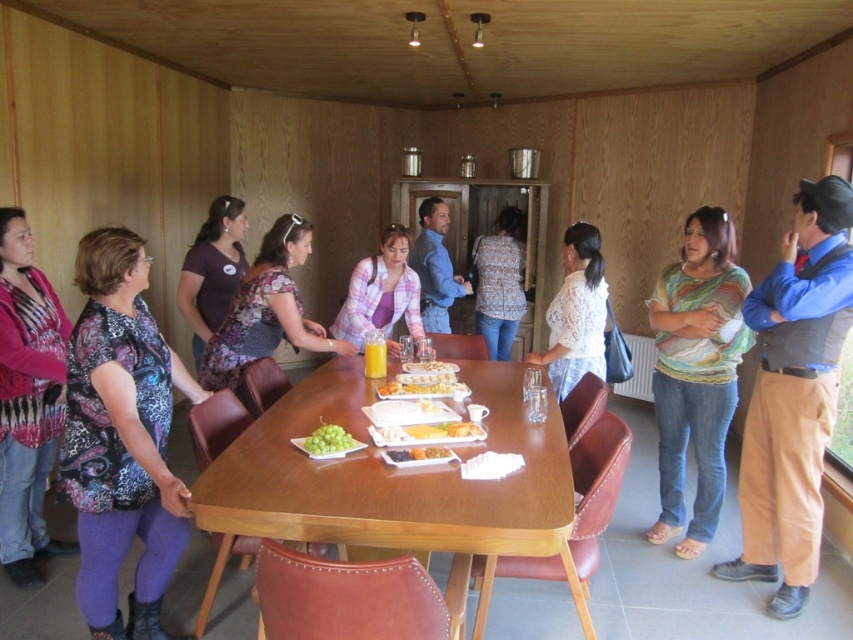
You are a photographer trying to capture a group photo of the people at the long wooden dining table. You want to ensure that both the floral fabric blouse at center and the patterned fabric shirt at center are clearly visible in the frame. Based on their positions, which one should you focus on first to ensure both are in the shot?

The floral fabric blouse at center is to the left of the patterned fabric shirt at center, so focusing on the patterned fabric shirt at center first will ensure both are included in the frame since the blouse is positioned to its left.

You are a photographer standing at the left end of the table. You want to take a photo that includes both the striped cotton shirt at right and the yellow cheese at center. Given that your camera has a maximum zoom range of 3 feet, can you capture both subjects in the same frame without moving?

The striped cotton shirt at right and yellow cheese at center are 4.23 feet apart from each other. Since the camera can only zoom up to 3 feet, the distance between them exceeds the maximum zoom range. Therefore, you cannot capture both subjects in the same frame without moving.

You are organizing a photoshoot and need to know if the floral fabric blouse at center can be displayed alongside the patterned fabric shirt at center on a narrow shelf. Based on their widths, can they both fit together?

The floral fabric blouse at center might be wider than patterned fabric shirt at center, so there is a possibility that they may not both fit on a narrow shelf together.